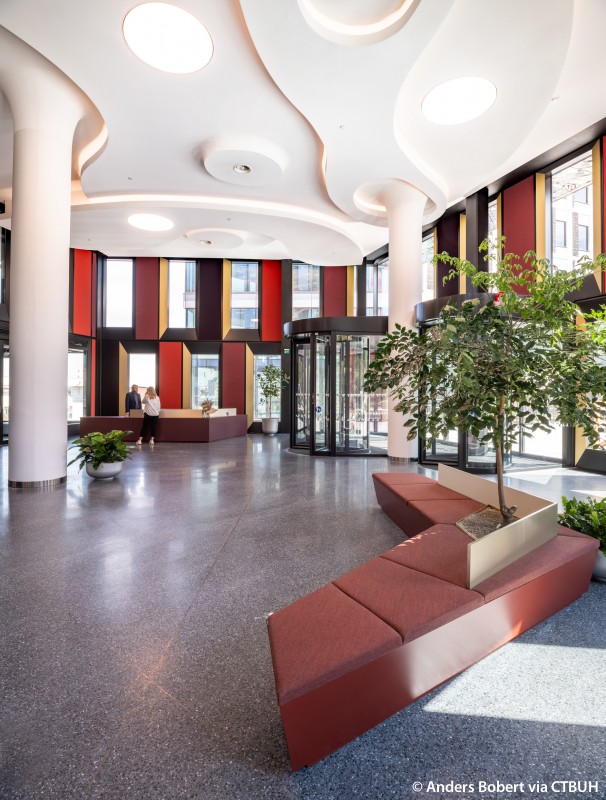
Identify the location of light. (177, 56), (168, 225), (451, 109).